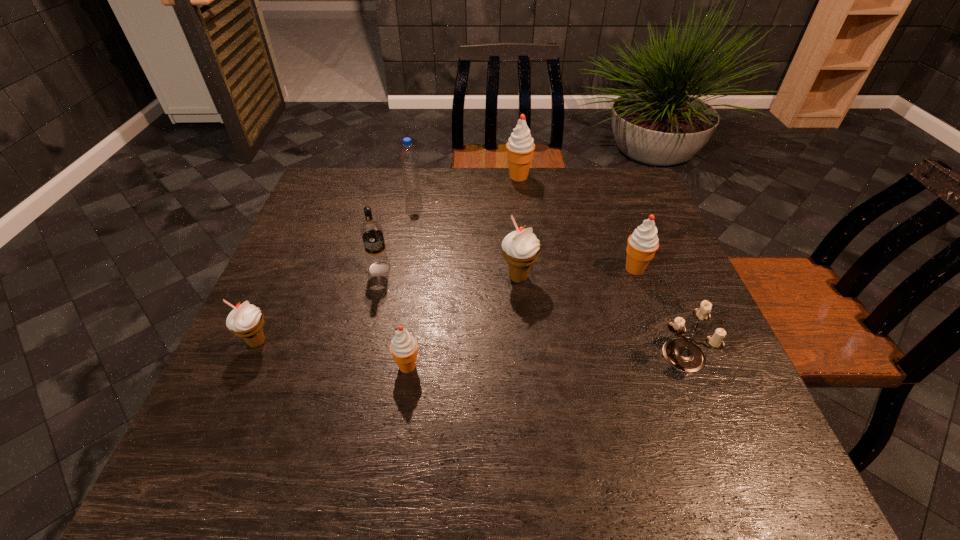
I want to click on the leftmost red icecream, so click(403, 347).

Find the location of `the nearer white icecream`. the nearer white icecream is located at coordinates (246, 320).

Locate an element on the screen. This screenshot has width=960, height=540. the leftmost object is located at coordinates (246, 320).

What are the coordinates of `blank area located on the right of the farthest red icecream` in the screenshot? It's located at (569, 177).

Locate an element on the screen. The width and height of the screenshot is (960, 540). free space located on the front of the seventh nearest object is located at coordinates (398, 275).

Locate an element on the screen. The height and width of the screenshot is (540, 960). vacant position located on the label of the vodka is located at coordinates (370, 309).

At what (x,y) coordinates should I click in order to perform the action: click on vacant space located 0.090m on the back of the farther white icecream. Please return your answer as a coordinate pair (x, y). Looking at the image, I should click on (516, 242).

Locate an element on the screen. The image size is (960, 540). vacant space located 0.210m on the front of the second farthest red icecream is located at coordinates (664, 348).

Identify the location of free region located on the back of the candle holder. This screenshot has width=960, height=540. click(637, 246).

Image resolution: width=960 pixels, height=540 pixels. I want to click on free space located on the front of the fourth object from left to right, so click(393, 468).